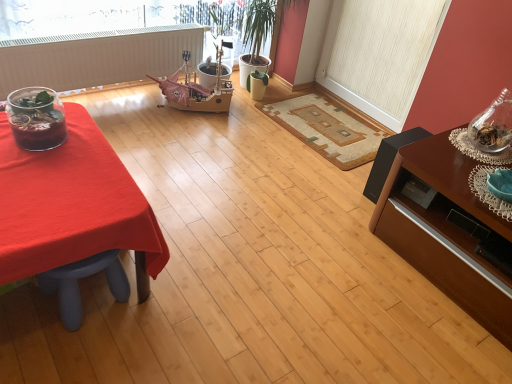
Locate an element on the screen. free spot in front of translucent glass terrarium at left is located at coordinates (31, 167).